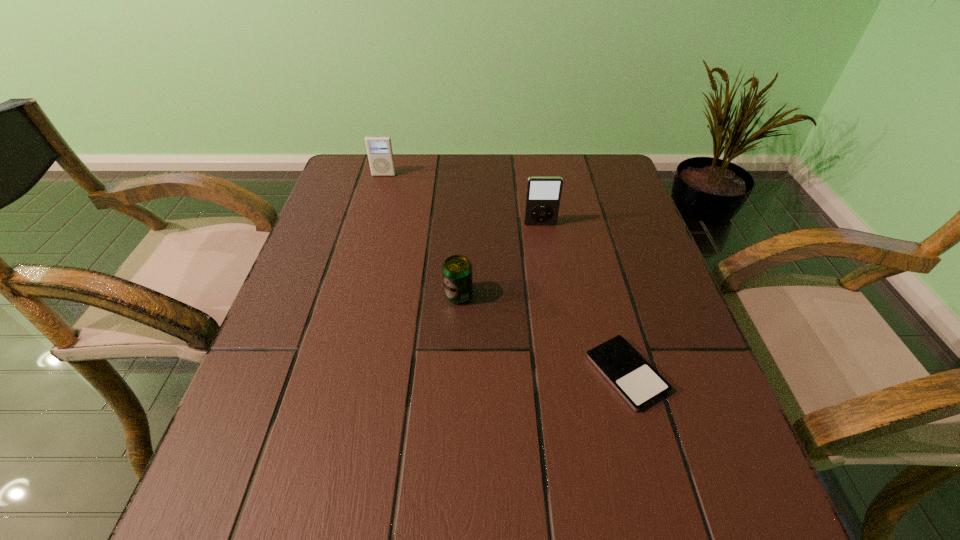
Locate an element on the screen. This screenshot has width=960, height=540. the second farthest iPod is located at coordinates (543, 194).

This screenshot has width=960, height=540. What are the coordinates of `the second object from right to left` in the screenshot? It's located at [x=543, y=194].

Where is `the farthest object`? the farthest object is located at coordinates (379, 148).

Find the location of a particular element. the leftmost object is located at coordinates (379, 148).

You are a GUI agent. You are given a task and a screenshot of the screen. Output one action in this format:
    pyautogui.click(x=<x>, y=<y>)
    Task: Click on the third tallest object
    The width and height of the screenshot is (960, 540).
    Given the screenshot: What is the action you would take?
    pyautogui.click(x=457, y=269)

The image size is (960, 540). Find the location of `the third farthest object`. the third farthest object is located at coordinates (457, 269).

This screenshot has height=540, width=960. I want to click on the rightmost object, so click(639, 384).

Locate an element on the screen. The width and height of the screenshot is (960, 540). the shortest iPod is located at coordinates (639, 384).

I want to click on vacant space located on the front-facing side of the third nearest object, so click(559, 347).

The height and width of the screenshot is (540, 960). Find the location of `vacant area located 0.060m on the front-facing side of the leftmost iPod`. vacant area located 0.060m on the front-facing side of the leftmost iPod is located at coordinates (380, 188).